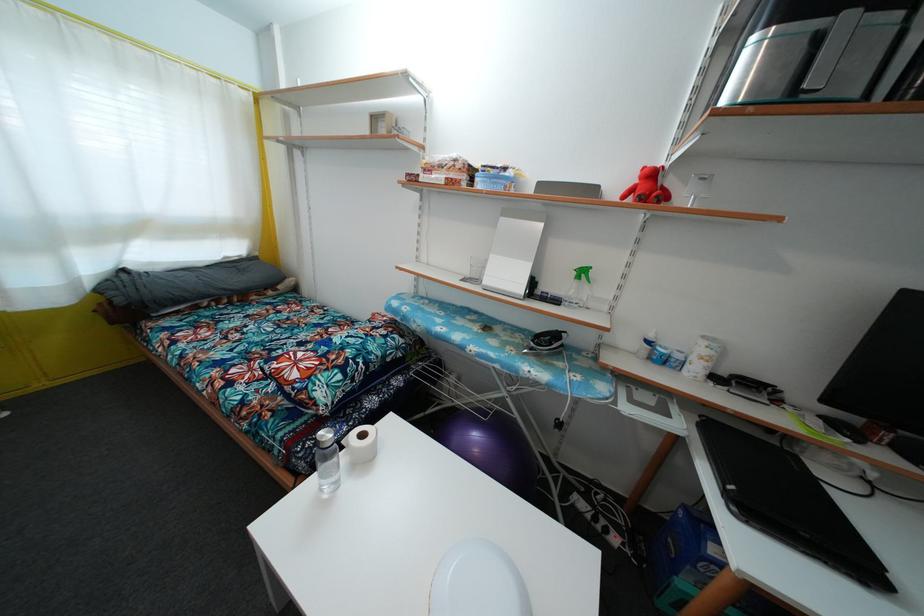
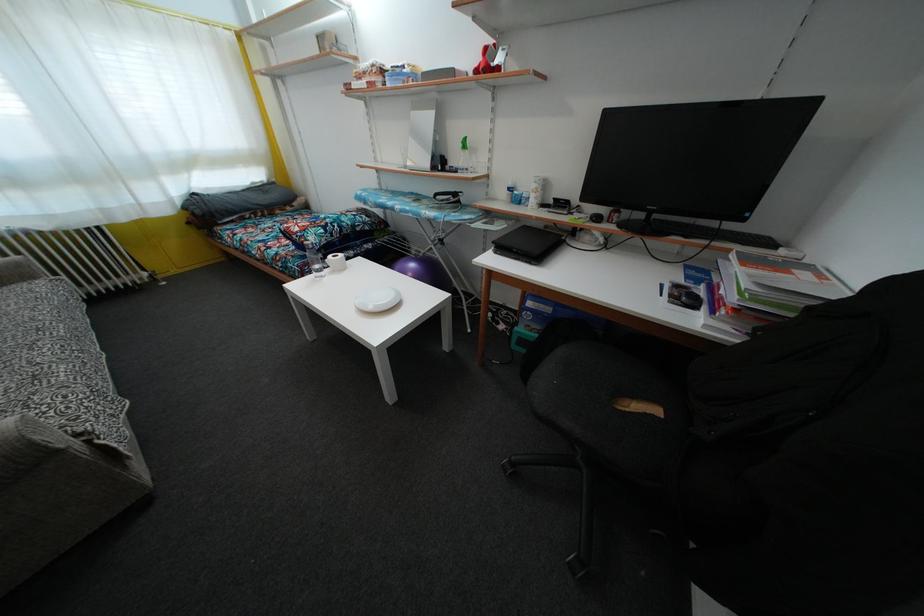
Find the pixel in the second image that matches (x=304, y=397) in the first image.

(305, 244)